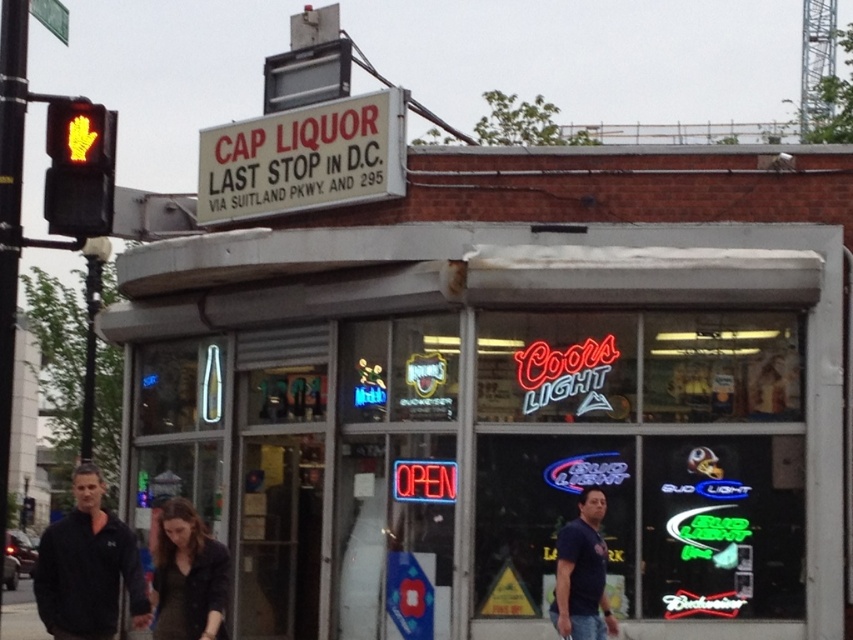
Is dark brown leather jacket at lower center bigger than dark blue t-shirt at lower right?

No.

Image resolution: width=853 pixels, height=640 pixels. What do you see at coordinates (189, 577) in the screenshot?
I see `dark brown leather jacket at lower center` at bounding box center [189, 577].

This screenshot has height=640, width=853. In order to click on dark brown leather jacket at lower center in this screenshot , I will do `click(189, 577)`.

How far apart are neon sign at center and white plastic sign at upper center?

A distance of 2.81 meters exists between neon sign at center and white plastic sign at upper center.

Which is below, neon sign at center or white plastic sign at upper center?

Positioned lower is neon sign at center.

Between point (525, 628) and point (235, 182), which one is positioned behind?

Point (235, 182)

At what (x,y) coordinates should I click in order to perform the action: click on neon sign at center. Please return your answer as a coordinate pair (x, y). This screenshot has width=853, height=640. Looking at the image, I should click on (503, 404).

Is white plastic sign at upper center wider than dark brown leather jacket at lower center?

Yes, white plastic sign at upper center is wider than dark brown leather jacket at lower center.

Between white plastic sign at upper center and dark brown leather jacket at lower center, which one is positioned higher?

white plastic sign at upper center is above.

Describe the element at coordinates (303, 157) in the screenshot. I see `white plastic sign at upper center` at that location.

Identify the location of white plastic sign at upper center. Image resolution: width=853 pixels, height=640 pixels. (303, 157).